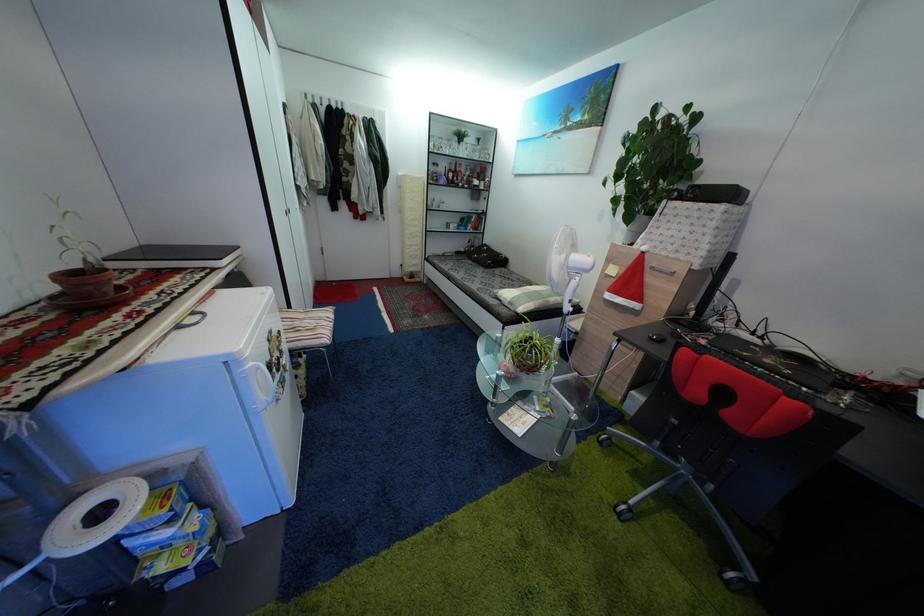
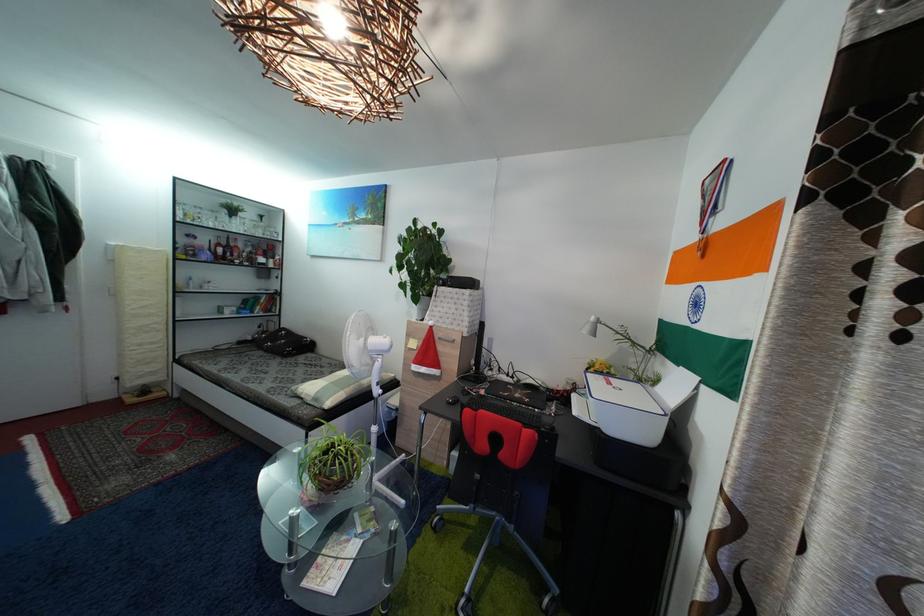
In the second image, find the point that corresponds to (650,244) in the first image.

(435, 321)